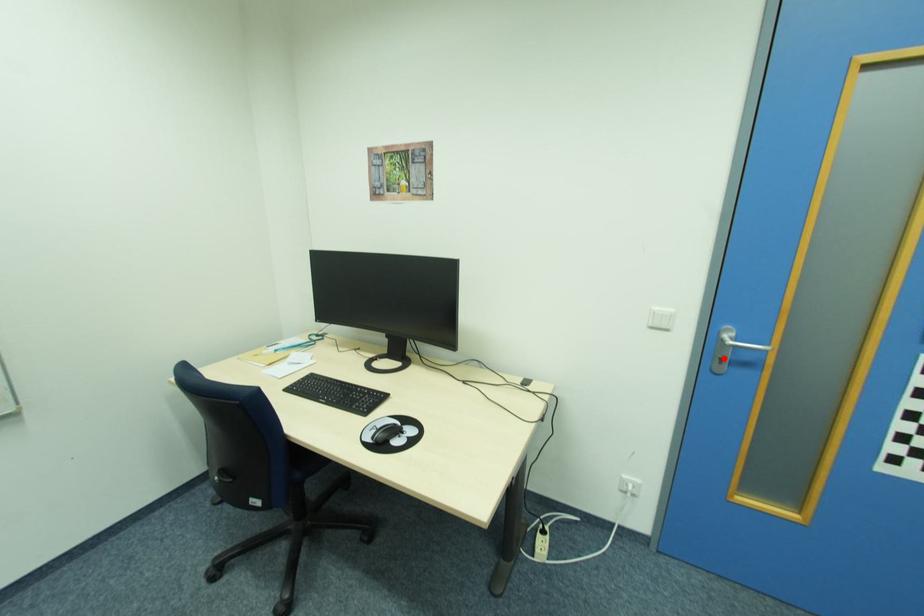
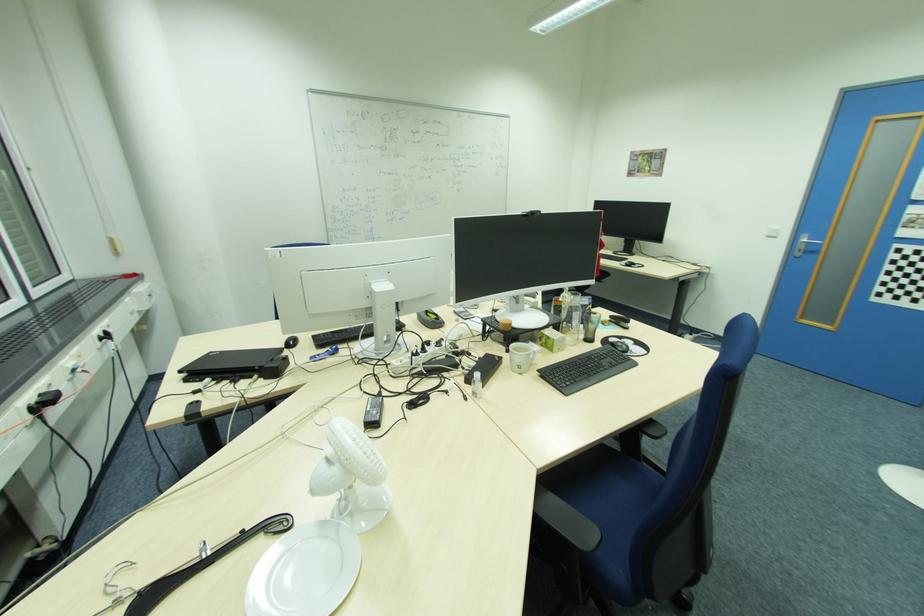
Find the pixel in the second image that matches the highlighted location in the first image.

(804, 251)